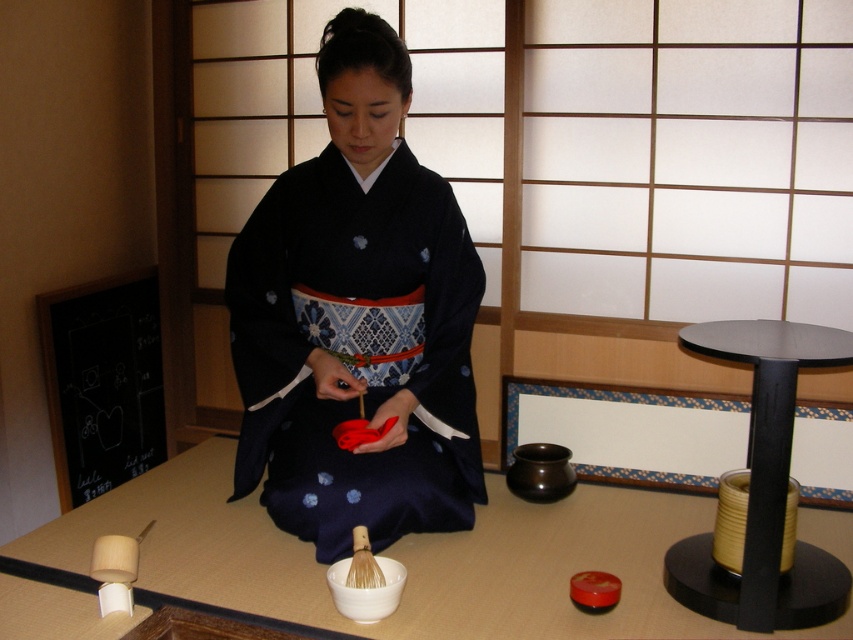
You are a photographer standing at the camera position. You need to place a small decorative item on the smooth wooden table at center so that it is visible in the photo. Considering the distance between you and the table, can you reach the table to place the item without moving closer?

The smooth wooden table at center is 5.20 feet from the camera. Since the average human arm length is about 2.5 feet, you cannot reach the table from your current position without moving closer.

Based on the scene description, where is the matte black kimono at center located in terms of its 2D coordinates?

The matte black kimono at center is located at the 2D coordinates of point [357,320].